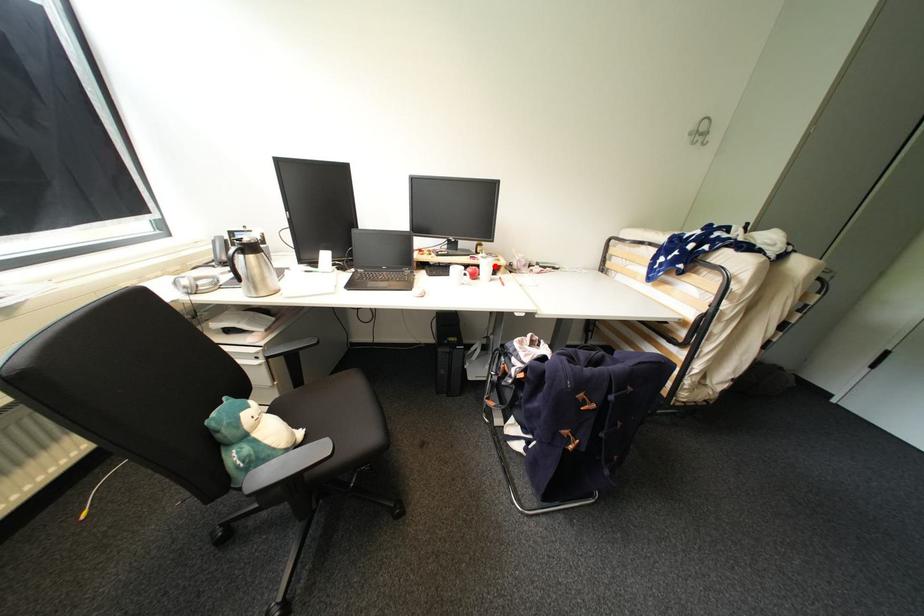
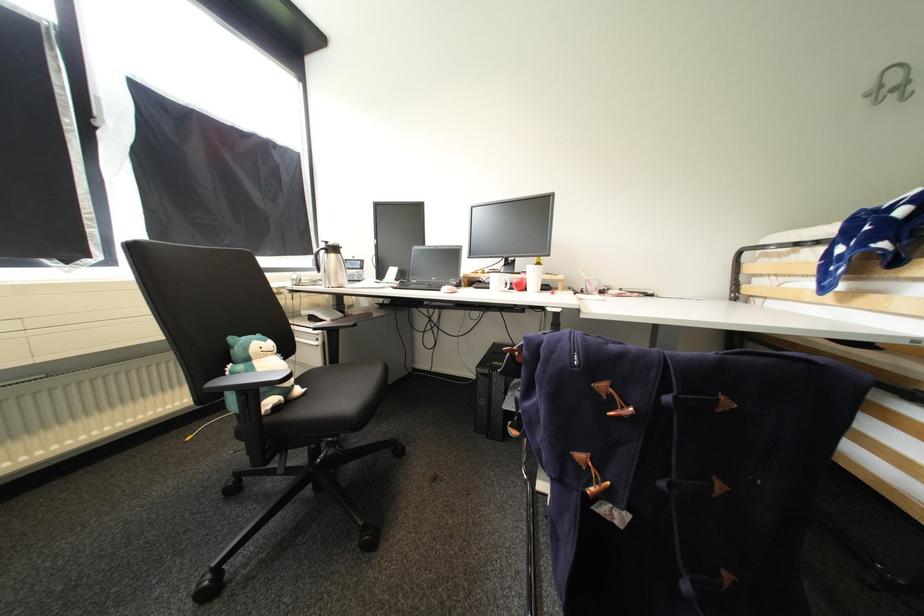
The point at the highlighted location is marked in the first image. Where is the corresponding point in the second image?

(541, 273)